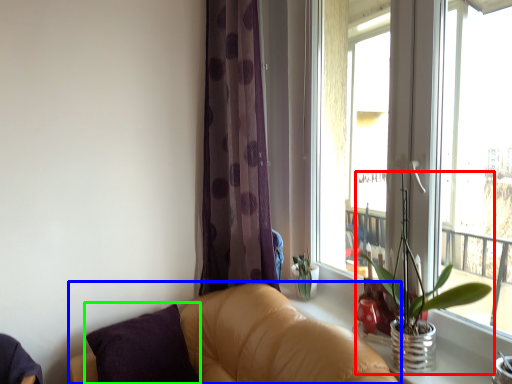
Question: Based on their relative distances, which object is farther from houseplant (highlighted by a red box)? Choose from studio couch (highlighted by a blue box) and pillow (highlighted by a green box).

Choices:
 (A) studio couch
 (B) pillow

Answer: (B)